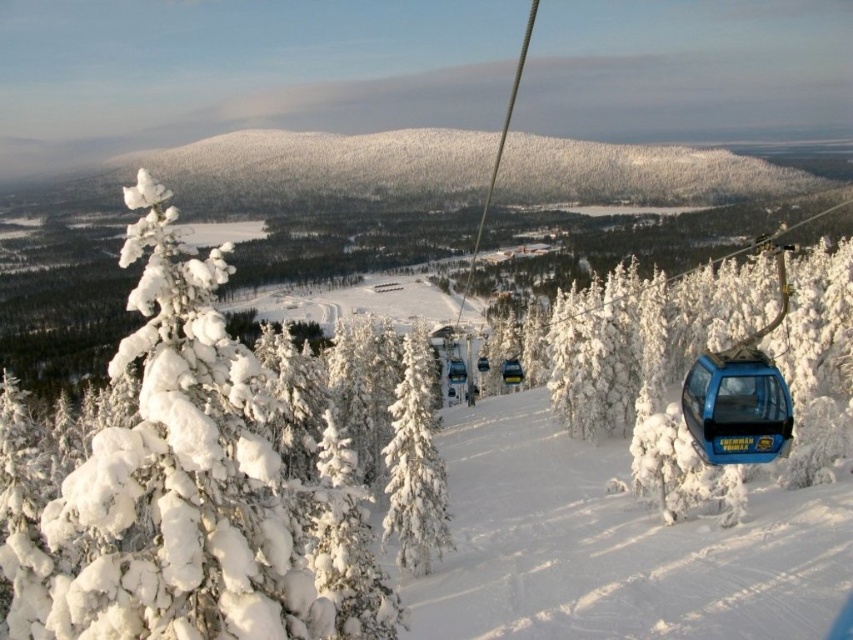
Between white snow-covered tree at center-left and blue glossy cable car at center-right, which one has more height?

white snow-covered tree at center-left is taller.

Consider the image. Who is positioned more to the right, white snow-covered tree at center-left or blue glossy cable car at center-right?

Positioned to the right is blue glossy cable car at center-right.

Which is behind, point (48, 577) or point (694, 440)?

Positioned behind is point (694, 440).

Where is `white snow-covered tree at center-left`? white snow-covered tree at center-left is located at coordinates (189, 486).

Which is above, blue glossy cable car at center-right or blue metallic gondola at center?

blue glossy cable car at center-right is above.

Does blue glossy cable car at center-right have a greater height compared to blue metallic gondola at center?

Yes, blue glossy cable car at center-right is taller than blue metallic gondola at center.

Who is more forward, (723, 422) or (506, 372)?

Point (723, 422) is more forward.

The height and width of the screenshot is (640, 853). I want to click on blue glossy cable car at center-right, so coord(735,406).

Can you confirm if blue glossy gondola at right is positioned above white snow-covered tree at center?

No.

Can you confirm if blue glossy gondola at right is bigger than white snow-covered tree at center?

Yes.

Find the location of a particular element. blue glossy gondola at right is located at coordinates (614, 545).

This screenshot has width=853, height=640. I want to click on blue glossy gondola at right, so click(614, 545).